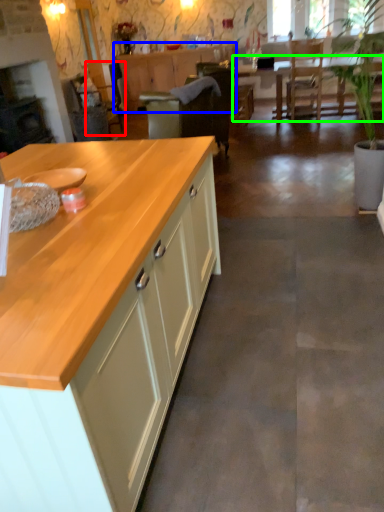
Question: Considering the real-world distances, which object is farthest from armchair (highlighted by a red box)? cabinetry (highlighted by a blue box) or table (highlighted by a green box)?

Choices:
 (A) cabinetry
 (B) table

Answer: (B)